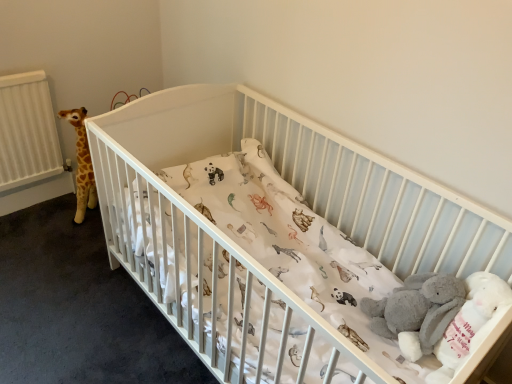
Question: Is white matte crib at center taller or shorter than gray plush baby elephant at lower right?

Choices:
 (A) short
 (B) tall

Answer: (B)

Question: Considering the positions of point (129, 160) and point (431, 322), is point (129, 160) closer or farther from the camera than point (431, 322)?

Choices:
 (A) farther
 (B) closer

Answer: (B)

Question: Looking at their shapes, would you say white matte crib at center is wider or thinner than gray plush baby elephant at lower right?

Choices:
 (A) thin
 (B) wide

Answer: (B)

Question: Considering the positions of gray plush baby elephant at lower right and white matte crib at center in the image, is gray plush baby elephant at lower right bigger or smaller than white matte crib at center?

Choices:
 (A) small
 (B) big

Answer: (A)

Question: In terms of height, does gray plush baby elephant at lower right look taller or shorter compared to white matte crib at center?

Choices:
 (A) short
 (B) tall

Answer: (A)

Question: Is gray plush baby elephant at lower right spatially inside white matte crib at center, or outside of it?

Choices:
 (A) outside
 (B) inside

Answer: (B)

Question: Visually, is gray plush baby elephant at lower right positioned to the left or to the right of white matte crib at center?

Choices:
 (A) right
 (B) left

Answer: (A)